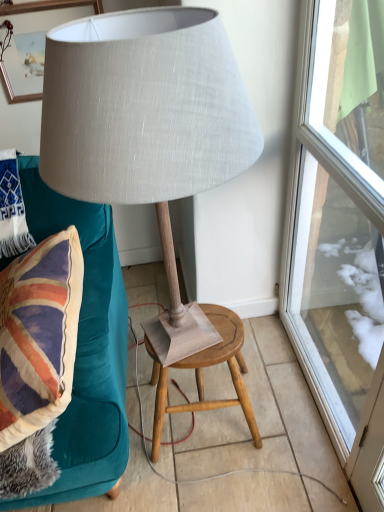
I want to click on vacant space in front of wooden stool at center, so click(221, 481).